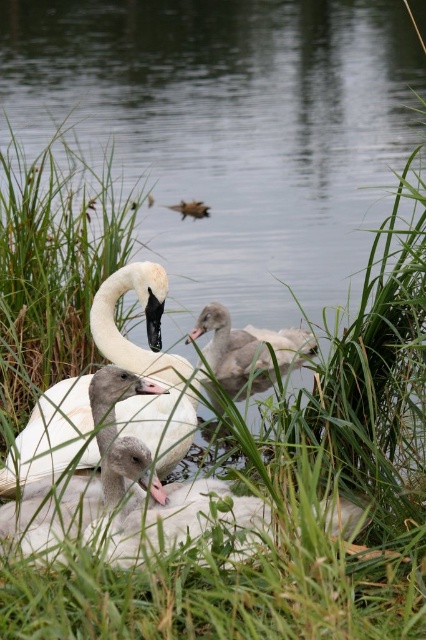
Is white glossy swan at center above gray downy duckling at center?

No, white glossy swan at center is not above gray downy duckling at center.

I want to click on white glossy swan at center, so click(146, 364).

Is white fluffy swan at center shorter than brown fuzzy duckling at center?

No, white fluffy swan at center is not shorter than brown fuzzy duckling at center.

Is point (104, 515) in front of point (192, 212)?

Yes, point (104, 515) is closer to viewer.

Who is more distant from viewer, [161,524] or [186,214]?

Point [186,214]

Where is `white fluffy swan at center`? The height and width of the screenshot is (640, 426). white fluffy swan at center is located at coordinates (166, 509).

Between white glossy swan at center and white fluffy swan at center, which one has less height?

white fluffy swan at center

Is point (158, 365) in front of point (207, 492)?

No, (158, 365) is further to viewer.

Is point (115, 328) in front of point (141, 541)?

That is False.

You are a GUI agent. You are given a task and a screenshot of the screen. Output one action in this format:
    pyautogui.click(x=<x>, y=<y>)
    Task: Click on the white glossy swan at center
    
    Given the screenshot: What is the action you would take?
    pyautogui.click(x=146, y=364)